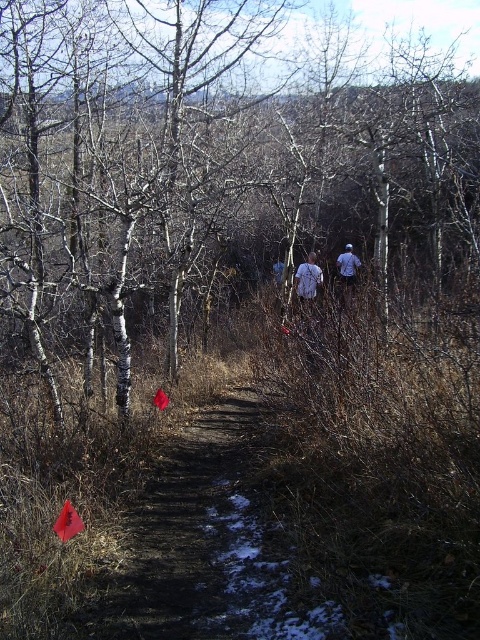
Is the position of white matte shirt at center more distant than that of blue denim jacket at center?

No, white matte shirt at center is closer to the viewer.

Does white matte shirt at center appear under blue denim jacket at center?

Indeed, white matte shirt at center is positioned under blue denim jacket at center.

Where is `white matte shirt at center`? white matte shirt at center is located at coordinates (308, 284).

Is white bark tree at center to the left of blue denim jacket at center from the viewer's perspective?

Correct, you'll find white bark tree at center to the left of blue denim jacket at center.

Can you confirm if white bark tree at center is bigger than blue denim jacket at center?

Correct, white bark tree at center is larger in size than blue denim jacket at center.

Does point (260, 108) lie in front of point (348, 285)?

That is False.

You are a GUI agent. You are given a task and a screenshot of the screen. Output one action in this format:
    pyautogui.click(x=<x>, y=<y>)
    Task: Click on the white bark tree at center
    This screenshot has width=480, height=640.
    Given the screenshot: What is the action you would take?
    pyautogui.click(x=207, y=168)

Between white bark tree at center and white matte shirt at center, which one has less height?

white matte shirt at center

Is white bark tree at center closer to camera compared to white matte shirt at center?

Yes, white bark tree at center is in front of white matte shirt at center.

Locate an element on the screen. The height and width of the screenshot is (640, 480). white bark tree at center is located at coordinates (207, 168).